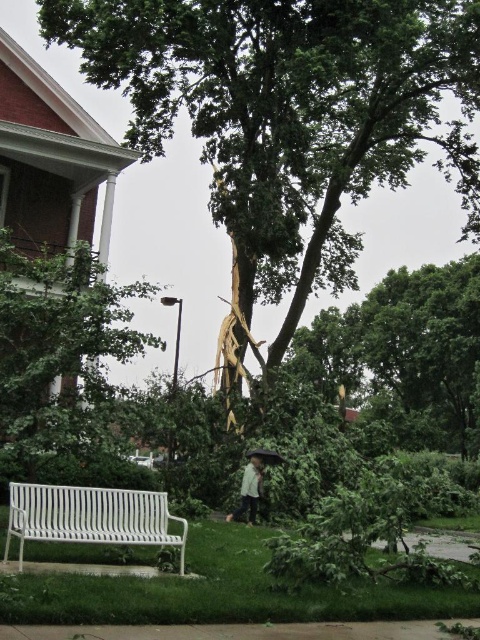
You are standing at point (60, 356) and want to move to the white metal bench in the foreground. Is the green leafy tree at left blocking your path?

The green leafy tree at left is located at point (60, 356), so it is directly at your current position. Therefore, it is not blocking your path to the white metal bench in the foreground.

You are a maintenance worker assessing the storm damage. You need to place a temporary barrier around the damaged tree. The barrier requires a clear space of 3 meters in diameter. Is there enough space between the white metal bench at lower left and the damaged tree to place the barrier?

The white metal bench at lower left is located at point (91, 516). Since the damaged tree is the central focus of the scene and the bench is positioned at the lower left corner, there is sufficient space between them to place a 3 meter diameter barrier without obstruction.

Looking at this image, you are standing in the storm damaged area and want to walk from point (215, 204) to point (275, 460). Which direction should you move to get closer to your destination?

To move from point (215, 204) to point (275, 460), you should move away from yourself since point (275, 460) is further away from the viewer than point (215, 204).